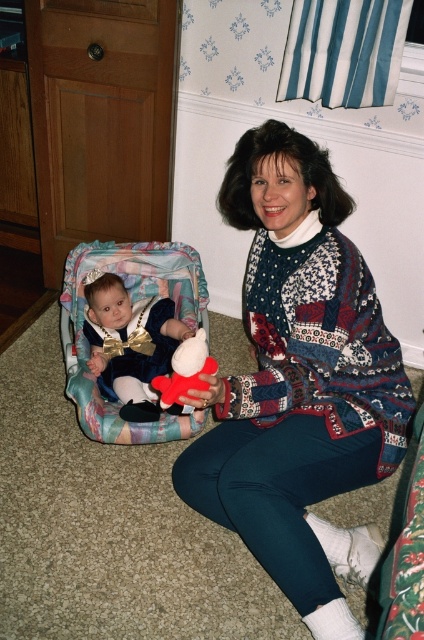
Does velvet blue baby at left have a smaller size compared to fluffy plush toy at center?

Actually, velvet blue baby at left might be larger than fluffy plush toy at center.

Is velvet blue baby at left closer to the viewer compared to fluffy plush toy at center?

No, it is behind fluffy plush toy at center.

The width and height of the screenshot is (424, 640). What do you see at coordinates (130, 344) in the screenshot?
I see `velvet blue baby at left` at bounding box center [130, 344].

You are a GUI agent. You are given a task and a screenshot of the screen. Output one action in this format:
    pyautogui.click(x=<x>, y=<y>)
    Task: Click on the velvet blue baby at left
    The height and width of the screenshot is (640, 424).
    Given the screenshot: What is the action you would take?
    pyautogui.click(x=130, y=344)

Does patterned sweater at center have a greater height compared to velvet blue baby at left?

Indeed, patterned sweater at center has a greater height compared to velvet blue baby at left.

Does patterned sweater at center lie in front of velvet blue baby at left?

That is True.

Image resolution: width=424 pixels, height=640 pixels. Find the location of `patterned sweater at center`. patterned sweater at center is located at coordinates (300, 381).

Identify the location of patterned sweater at center. This screenshot has width=424, height=640. (300, 381).

Does patterned sweater at center have a larger size compared to fluffy plush toy at center?

Yes.

Can you confirm if patterned sweater at center is taller than fluffy plush toy at center?

Yes, patterned sweater at center is taller than fluffy plush toy at center.

Does point (304, 321) come in front of point (180, 380)?

That is False.

Where is `patterned sweater at center`? This screenshot has height=640, width=424. patterned sweater at center is located at coordinates (300, 381).